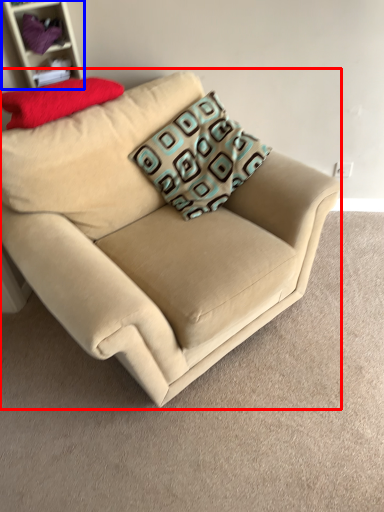
Question: Which of the following is the closest to the observer, studio couch (highlighted by a red box) or shelf (highlighted by a blue box)?

Choices:
 (A) studio couch
 (B) shelf

Answer: (A)